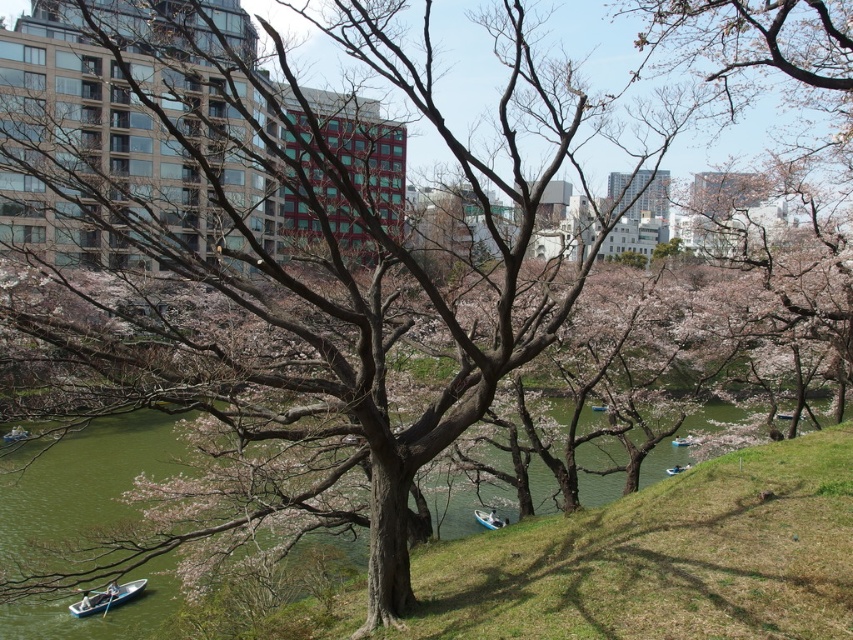
You are a photographer standing in the park and want to capture both white plastic boat at lower left and white plastic boat at lower right in your shot. Which boat is closer to the ground?

The white plastic boat at lower left has a lesser height compared to the white plastic boat at lower right, so it is closer to the ground.

You are standing at the center of the park and notice a white plastic boat at lower left. If you want to walk directly towards it, which direction should you head? Please consider the coordinates provided in the description.

The white plastic boat at lower left is located at point (105, 596), which means it is positioned to the lower left from your current position at the center. To reach it, you should walk towards the lower left direction.